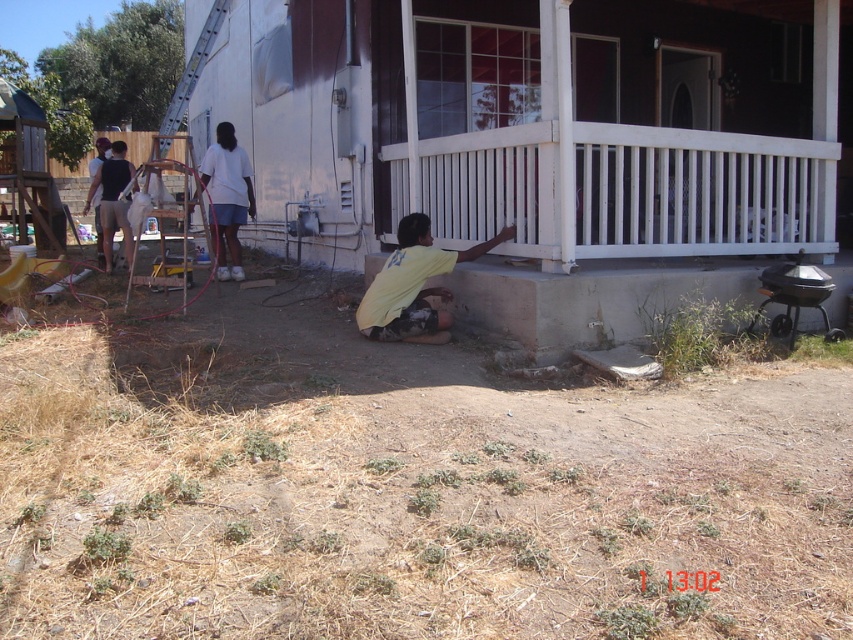
You are standing at the point labeled as point (619,189) in the image. What object are you currently standing on?

You are standing on the white painted wood porch at lower right indicated by point (619,189).

You are a painter working on the porch. You need to reach the paint bucket held by the person in the white cotton shirt at upper left. The distance you can stretch is 2 meters. Can you reach the paint bucket without moving from your current position at the yellow matte shirt at center?

The yellow matte shirt at center and white cotton shirt at upper left are 3.17 meters apart from each other. Since the maximum reach is 2 meters, you cannot reach the paint bucket without moving.